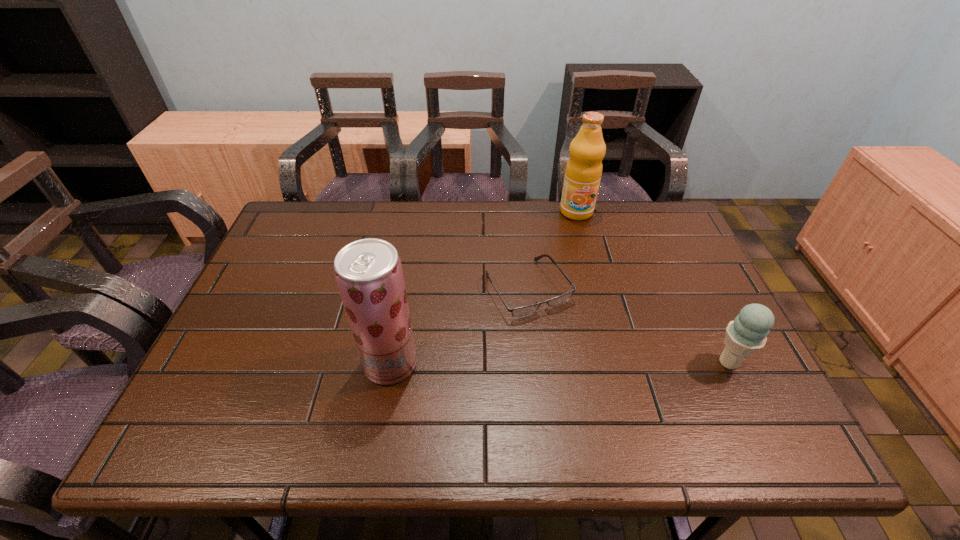
Where is `vacant area that lies between the leftmost object and the farther fruit juice`? The image size is (960, 540). vacant area that lies between the leftmost object and the farther fruit juice is located at coordinates (483, 288).

Identify the location of free area in between the left fruit juice and the rightmost object. (560, 363).

Image resolution: width=960 pixels, height=540 pixels. In order to click on unoccupied area between the second object from left to right and the leftmost object in this screenshot , I will do `click(460, 326)`.

At what (x,y) coordinates should I click in order to perform the action: click on vacant space that is in between the farther fruit juice and the nearer fruit juice. Please return your answer as a coordinate pair (x, y). Image resolution: width=960 pixels, height=540 pixels. Looking at the image, I should click on (483, 288).

What are the coordinates of `vacant area that lies between the leftmost object and the third tallest object` in the screenshot? It's located at (560, 363).

The image size is (960, 540). Identify the location of free point between the shortest object and the leftmost object. (460, 326).

You are a GUI agent. You are given a task and a screenshot of the screen. Output one action in this format:
    pyautogui.click(x=<x>, y=<y>)
    Task: Click on the second closest object to the third object from right to left
    The width and height of the screenshot is (960, 540).
    Given the screenshot: What is the action you would take?
    pyautogui.click(x=583, y=172)

Image resolution: width=960 pixels, height=540 pixels. I want to click on the third closest object to the leftmost object, so click(747, 334).

I want to click on vacant space that satisfies the following two spatial constraints: 1. on the back side of the spectacles; 2. on the right side of the farthest object, so click(520, 212).